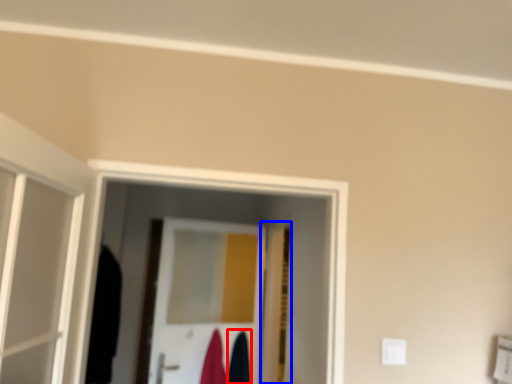
Question: Which of the following is the farthest to the observer, robe (highlighted by a red box) or door (highlighted by a blue box)?

Choices:
 (A) robe
 (B) door

Answer: (A)